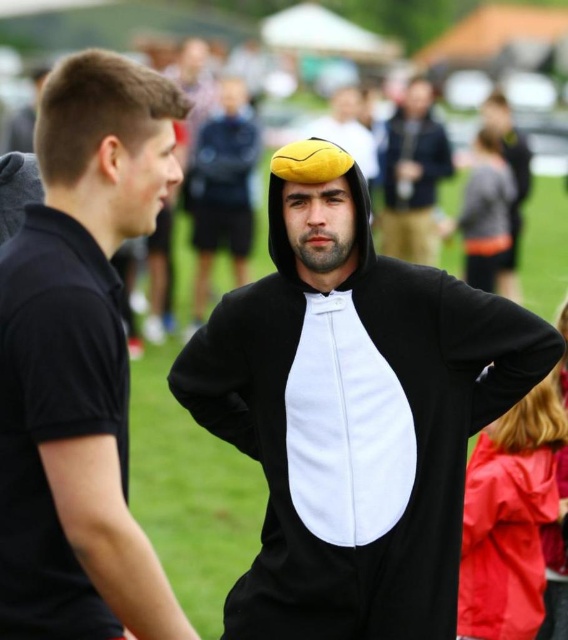
Question: Among these objects, which one is nearest to the camera?

Choices:
 (A) black matte costume at center
 (B) black fleece onesie at right

Answer: (B)

Question: Is black fleece onesie at right positioned at the back of rubberized red raincoat at lower right?

Choices:
 (A) no
 (B) yes

Answer: (A)

Question: Does black fleece onesie at center lie behind matte yellow beret at upper center?

Choices:
 (A) no
 (B) yes

Answer: (A)

Question: Which point is farther to the camera?

Choices:
 (A) rubberized red raincoat at lower right
 (B) matte yellow beret at upper center
 (C) black matte costume at center
 (D) black fleece onesie at right

Answer: (B)

Question: Which point is closer to the camera?

Choices:
 (A) [34, 259]
 (B) [498, 484]
 (C) [383, 243]

Answer: (A)

Question: Can you confirm if black fleece onesie at center is positioned to the left of rubberized red raincoat at lower right?

Choices:
 (A) no
 (B) yes

Answer: (B)